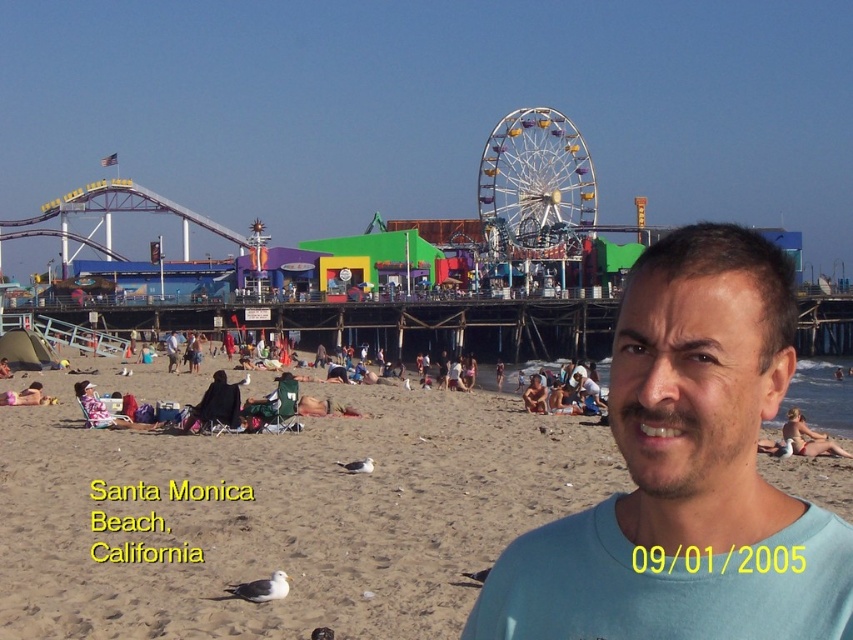
You are standing on the beige sand at lower center and want to take a photo of the yellow metallic ferris wheel at center. Can you see the top of the ferris wheel from your current position?

The beige sand at lower center is shorter than the yellow metallic ferris wheel at center, so yes, you can see the top of the ferris wheel from your current position on the beige sand at lower center.